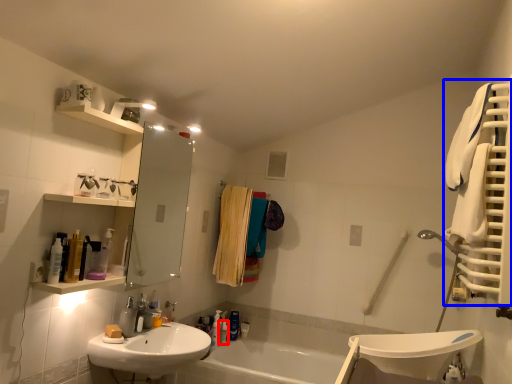
Question: Among these objects, which one is farthest to the camera, toiletry (highlighted by a red box) or bath towel (highlighted by a blue box)?

Choices:
 (A) toiletry
 (B) bath towel

Answer: (A)